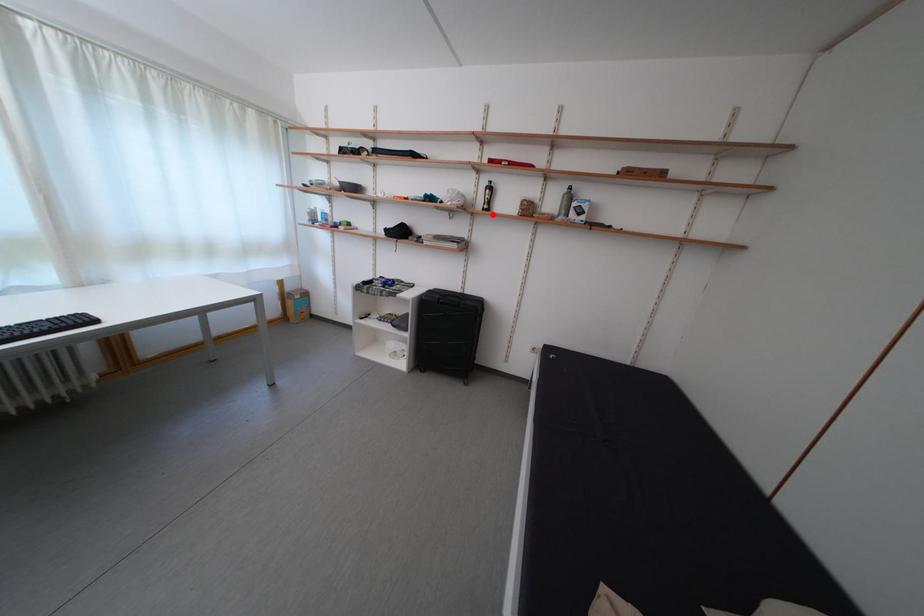
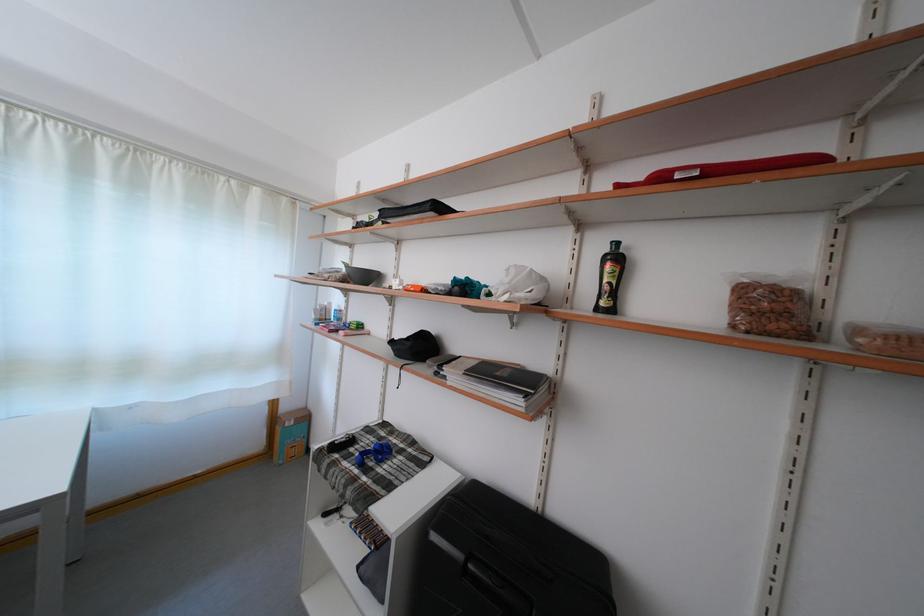
Question: I am providing you with two images of the same scene from different viewpoints. In image1, a red point is highlighted. Considering the same 3D point in image2, which of the following is correct?

Choices:
 (A) It is closer
 (B) It is farther

Answer: (B)